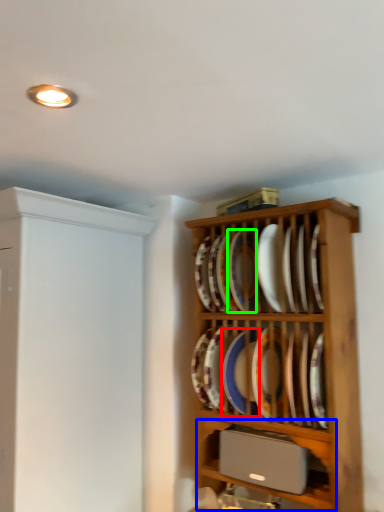
Question: Which is nearer to the platter (highlighted by a red box)? shelf (highlighted by a blue box) or platter (highlighted by a green box).

Choices:
 (A) shelf
 (B) platter

Answer: (B)